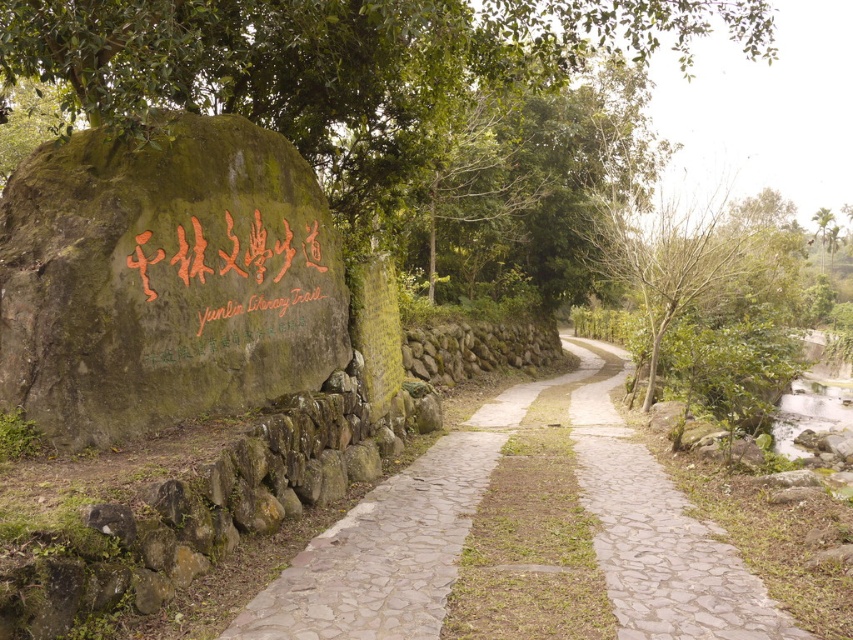
Question: Is green leafy tree at upper center bigger than natural stone path at center?

Choices:
 (A) yes
 (B) no

Answer: (A)

Question: Estimate the real-world distances between objects in this image. Which object is farther from the green mossy rock at left?

Choices:
 (A) natural stone path at center
 (B) green leafy tree at upper center

Answer: (B)

Question: Which of the following is the farthest from the observer?

Choices:
 (A) green leafy tree at upper center
 (B) natural stone path at center

Answer: (A)

Question: Where is green leafy tree at upper center located in relation to natural stone path at center in the image?

Choices:
 (A) left
 (B) right

Answer: (B)

Question: Estimate the real-world distances between objects in this image. Which object is farther from the green mossy rock at left?

Choices:
 (A) green leafy tree at upper center
 (B) natural stone path at center

Answer: (A)

Question: Does green mossy rock at left appear on the left side of natural stone path at center?

Choices:
 (A) yes
 (B) no

Answer: (A)